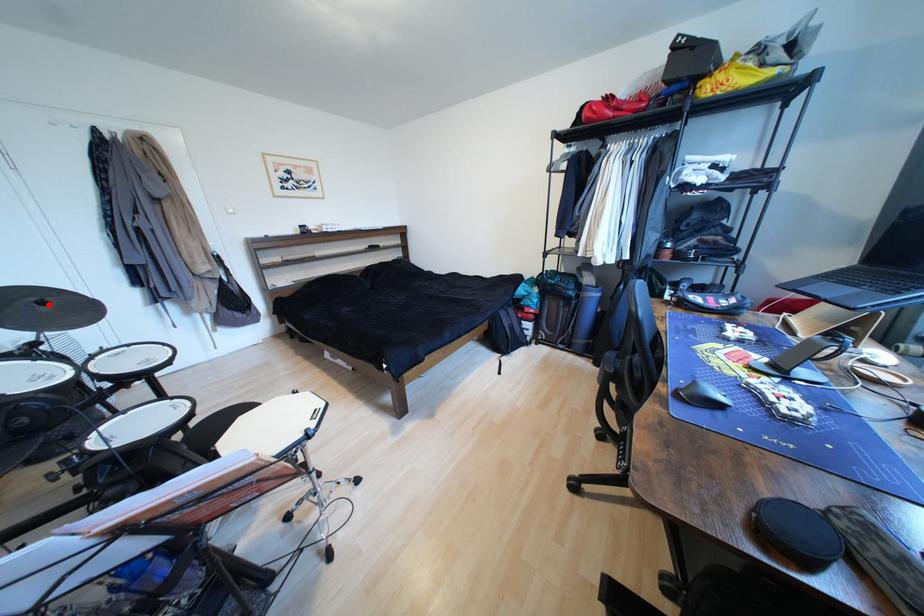
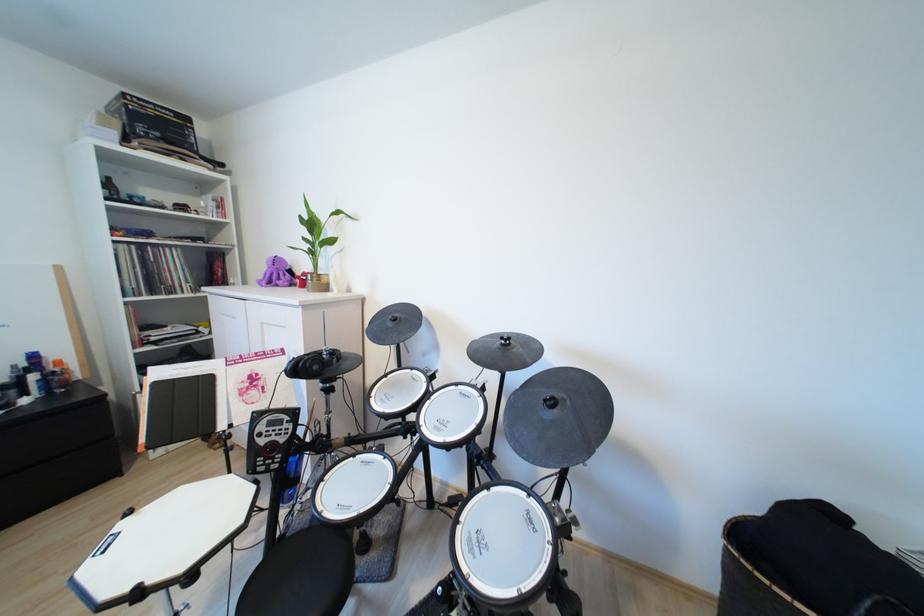
Find the pixel in the second image that matches the highlighted location in the first image.

(560, 405)